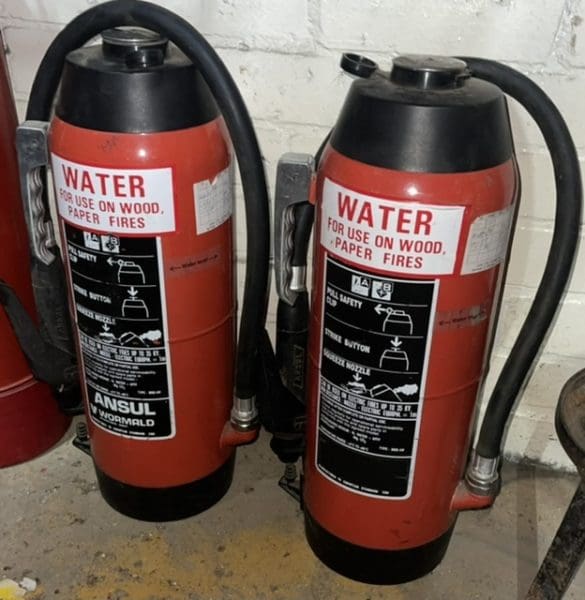
Find the location of a particular element. chair is located at coordinates [581, 412].